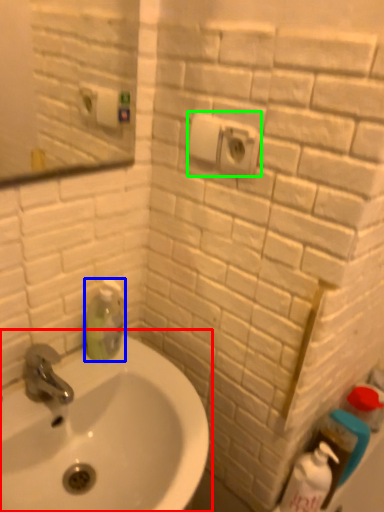
Question: Which object is positioned farthest from sink (highlighted by a red box)? Select from cleaning product (highlighted by a blue box) and electric outlet (highlighted by a green box).

Choices:
 (A) cleaning product
 (B) electric outlet

Answer: (B)